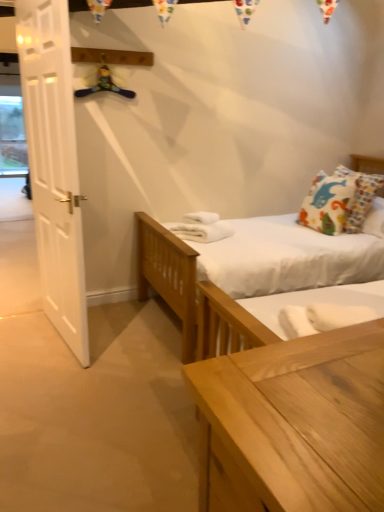
What do you see at coordinates (339, 201) in the screenshot? This screenshot has height=512, width=384. I see `printed fabric pillow at upper right` at bounding box center [339, 201].

At what (x,y) coordinates should I click in order to perform the action: click on yellow fabric hanger at upper center. Please return your answer as a coordinate pair (x, y). The image size is (384, 512). Looking at the image, I should click on (104, 84).

Which is nearer, (106, 69) or (338, 212)?

Point (106, 69) appears to be closer to the viewer than point (338, 212).

I want to click on hanger in front of the printed fabric pillow at upper right, so click(x=104, y=84).

Looking at this image, how many degrees apart are the facing directions of yellow fabric hanger at upper center and printed fabric pillow at upper right?

The facing directions of yellow fabric hanger at upper center and printed fabric pillow at upper right are 89.7 degrees apart.

Considering the relative positions of yellow fabric hanger at upper center and printed fabric pillow at upper right in the image provided, is yellow fabric hanger at upper center in front of printed fabric pillow at upper right?

Yes, it is.

Which is closer to the camera, [53,31] or [320,222]?

The point [53,31] is more forward.

From the image's perspective, is white wooden door at left over printed fabric pillow at upper right?

Incorrect, from the image's perspective, white wooden door at left is lower than printed fabric pillow at upper right.

Would you say white wooden door at left is a long distance from printed fabric pillow at upper right?

Yes, white wooden door at left and printed fabric pillow at upper right are located far from each other.

Is white wooden door at left to the right of yellow fabric hanger at upper center from the viewer's perspective?

No.

Locate an element on the screen. Image resolution: width=384 pixels, height=512 pixels. door on the left of yellow fabric hanger at upper center is located at coordinates (54, 165).

From the image's perspective, which one is positioned higher, white wooden door at left or yellow fabric hanger at upper center?

From the image's view, yellow fabric hanger at upper center is above.

From a real-world perspective, is white wooden door at left physically above yellow fabric hanger at upper center?

No.

Consider the image. Is printed fabric pillow at upper right next to white wooden door at left?

No, printed fabric pillow at upper right is not in contact with white wooden door at left.

This screenshot has width=384, height=512. In order to click on pillow on the right side of white wooden door at left in this screenshot , I will do `click(339, 201)`.

Consider the image. From a real-world perspective, is printed fabric pillow at upper right located higher than white wooden door at left?

No, from a real-world perspective, printed fabric pillow at upper right is not on top of white wooden door at left.

Measure the distance between printed fabric pillow at upper right and yellow fabric hanger at upper center.

1.66 meters.

Which is more to the right, printed fabric pillow at upper right or yellow fabric hanger at upper center?

printed fabric pillow at upper right is more to the right.

Which object is wider, printed fabric pillow at upper right or yellow fabric hanger at upper center?

printed fabric pillow at upper right.

The height and width of the screenshot is (512, 384). I want to click on door located below the yellow fabric hanger at upper center (from the image's perspective), so click(54, 165).

Is white wooden door at left surrounded by yellow fabric hanger at upper center?

That's incorrect, white wooden door at left is not inside yellow fabric hanger at upper center.

Which of these two, yellow fabric hanger at upper center or white wooden door at left, stands shorter?

With less height is yellow fabric hanger at upper center.

Identify the location of pillow that is below the yellow fabric hanger at upper center (from the image's perspective). (339, 201).

What are the coordinates of `pillow that appears on the right of white wooden door at left` in the screenshot? It's located at (339, 201).

When comparing their distances from yellow fabric hanger at upper center, does white wooden door at left or printed fabric pillow at upper right seem closer?

Among the two, white wooden door at left is located nearer to yellow fabric hanger at upper center.

Based on their spatial positions, is white wooden door at left or yellow fabric hanger at upper center closer to printed fabric pillow at upper right?

Based on the image, yellow fabric hanger at upper center appears to be nearer to printed fabric pillow at upper right.

Based on their spatial positions, is yellow fabric hanger at upper center or printed fabric pillow at upper right further from white wooden door at left?

Among the two, printed fabric pillow at upper right is located further to white wooden door at left.

From the image, which object appears to be farther from printed fabric pillow at upper right, yellow fabric hanger at upper center or white wooden door at left?

The object further to printed fabric pillow at upper right is white wooden door at left.

From the image, which object appears to be farther from yellow fabric hanger at upper center, printed fabric pillow at upper right or white wooden door at left?

printed fabric pillow at upper right.

Based on their spatial positions, is printed fabric pillow at upper right or yellow fabric hanger at upper center closer to white wooden door at left?

The object closer to white wooden door at left is yellow fabric hanger at upper center.

The width and height of the screenshot is (384, 512). Find the location of `hanger between white wooden door at left and printed fabric pillow at upper right in the horizontal direction`. hanger between white wooden door at left and printed fabric pillow at upper right in the horizontal direction is located at coordinates (104, 84).